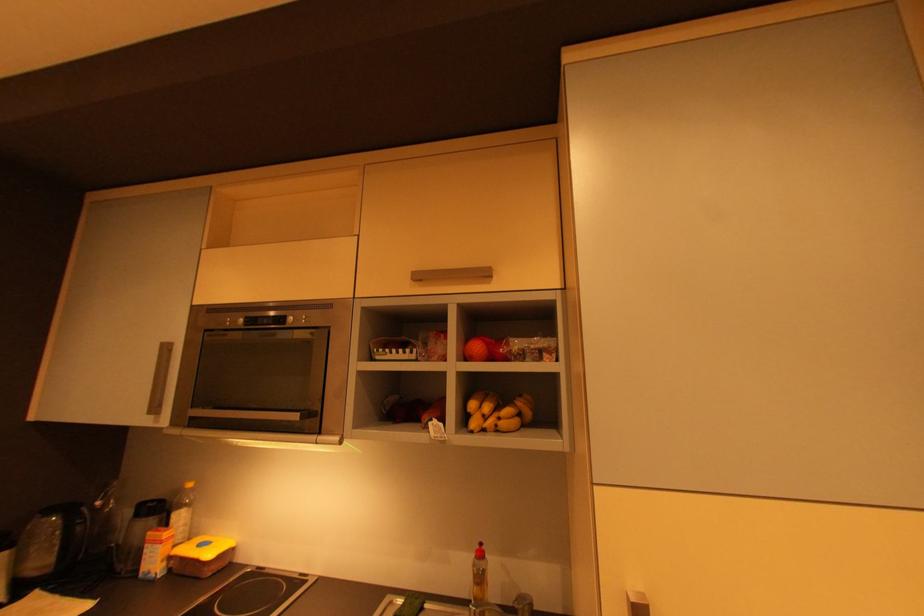
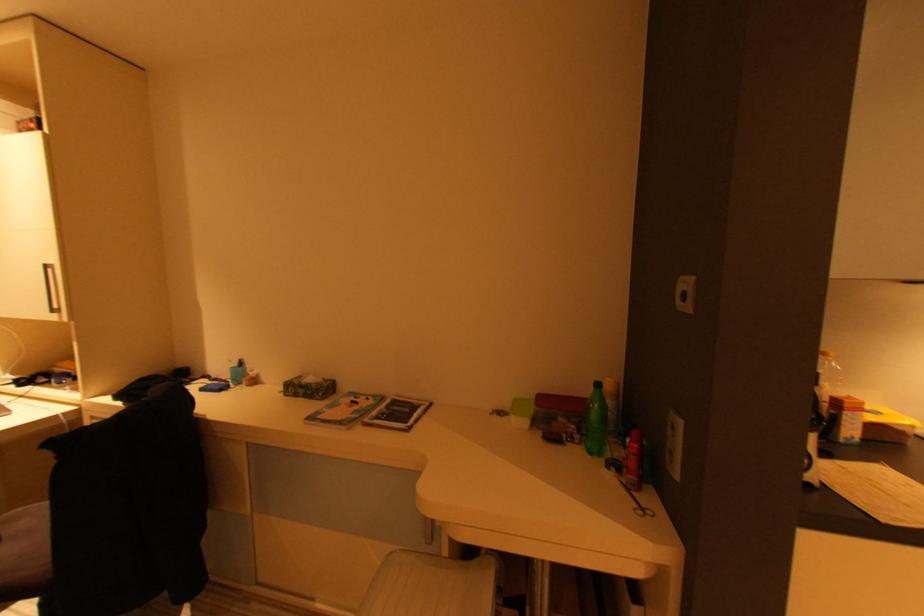
Question: Which direction would the cameraman need to move to produce the second image? Reply with the corresponding letter.

Choices:
 (A) Left
 (B) Right
 (C) Forward
 (D) Backward

Answer: (A)